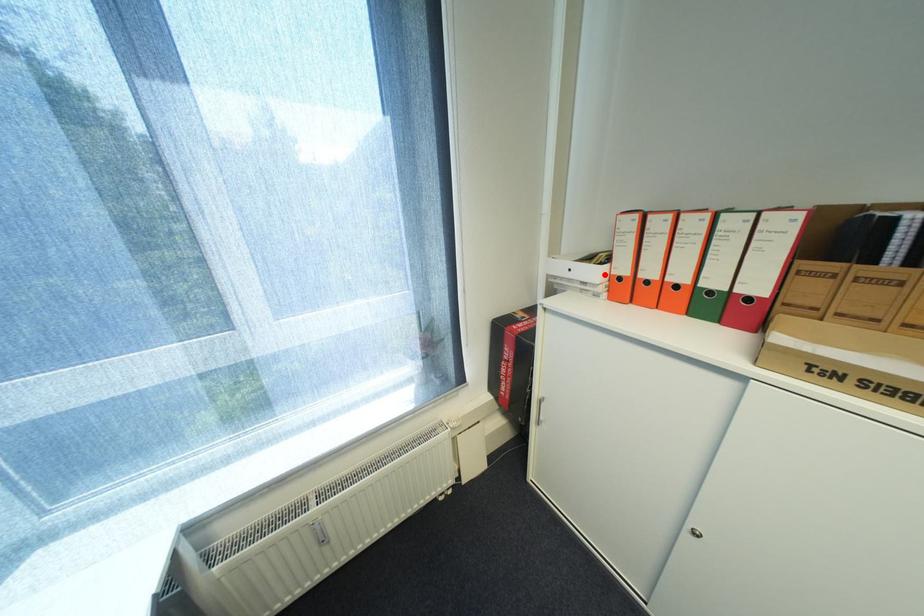
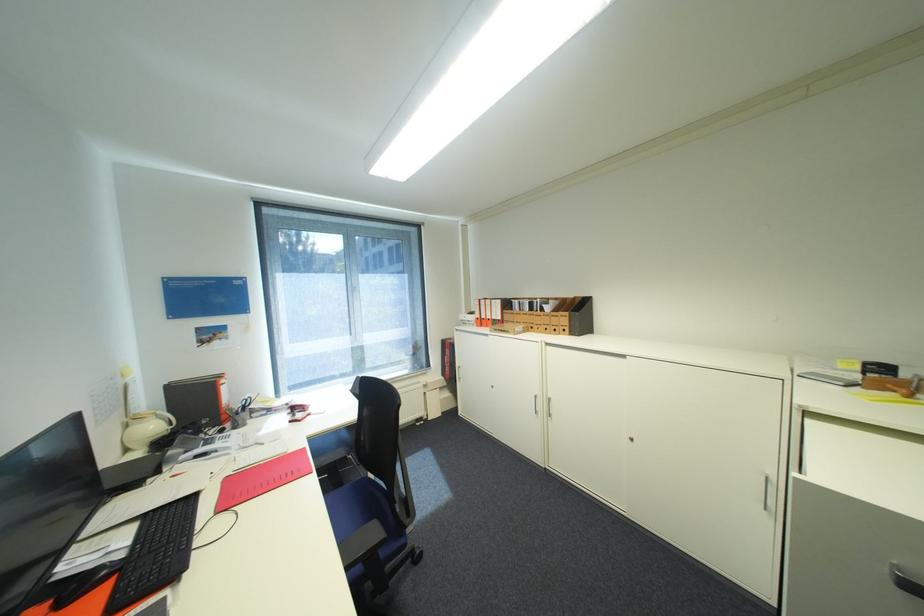
Where in the second image is the point corresponding to the highlighted location from the first image?

(480, 318)